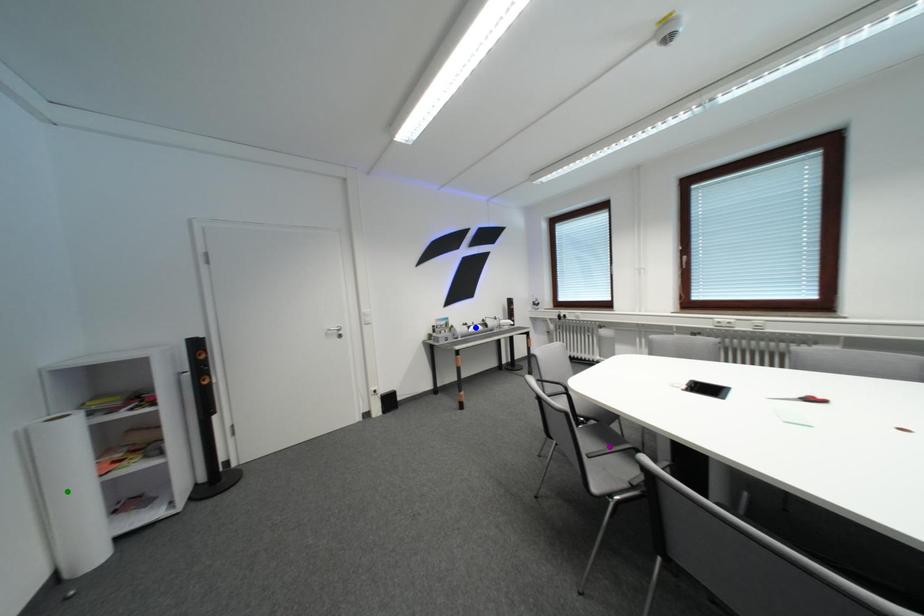
Order these from nearest to farthest:
blue point | purple point | green point

blue point < purple point < green point